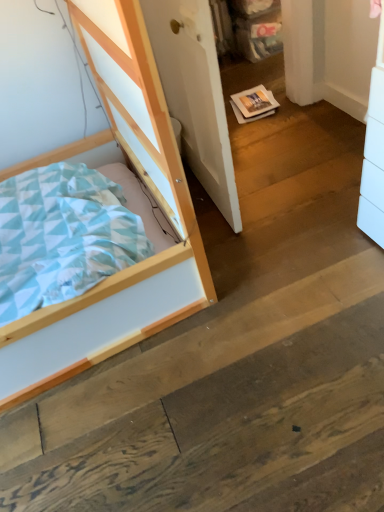
Question: From the image's perspective, is light wood bed at left located beneath white matte door at center?

Choices:
 (A) yes
 (B) no

Answer: (A)

Question: Does light wood bed at left turn towards white matte door at center?

Choices:
 (A) yes
 (B) no

Answer: (B)

Question: Can you confirm if light wood bed at left is shorter than white matte door at center?

Choices:
 (A) no
 (B) yes

Answer: (A)

Question: Is light wood bed at left next to white matte door at center?

Choices:
 (A) no
 (B) yes

Answer: (A)

Question: Would you consider light wood bed at left to be distant from white matte door at center?

Choices:
 (A) yes
 (B) no

Answer: (B)

Question: Considering the relative sizes of light wood bed at left and white matte door at center in the image provided, is light wood bed at left thinner than white matte door at center?

Choices:
 (A) yes
 (B) no

Answer: (B)

Question: From a real-world perspective, is white matte door at center positioned over light wood bed at left based on gravity?

Choices:
 (A) yes
 (B) no

Answer: (B)

Question: Considering the relative sizes of white matte door at center and light wood bed at left in the image provided, is white matte door at center thinner than light wood bed at left?

Choices:
 (A) no
 (B) yes

Answer: (B)

Question: Is white matte door at center aimed at light wood bed at left?

Choices:
 (A) yes
 (B) no

Answer: (A)

Question: Is white matte door at center far from light wood bed at left?

Choices:
 (A) yes
 (B) no

Answer: (B)

Question: From the image's perspective, is white matte door at center above light wood bed at left?

Choices:
 (A) yes
 (B) no

Answer: (A)

Question: From a real-world perspective, is white matte door at center below light wood bed at left?

Choices:
 (A) no
 (B) yes

Answer: (B)

Question: Is point (188, 10) closer or farther from the camera than point (188, 284)?

Choices:
 (A) closer
 (B) farther

Answer: (A)